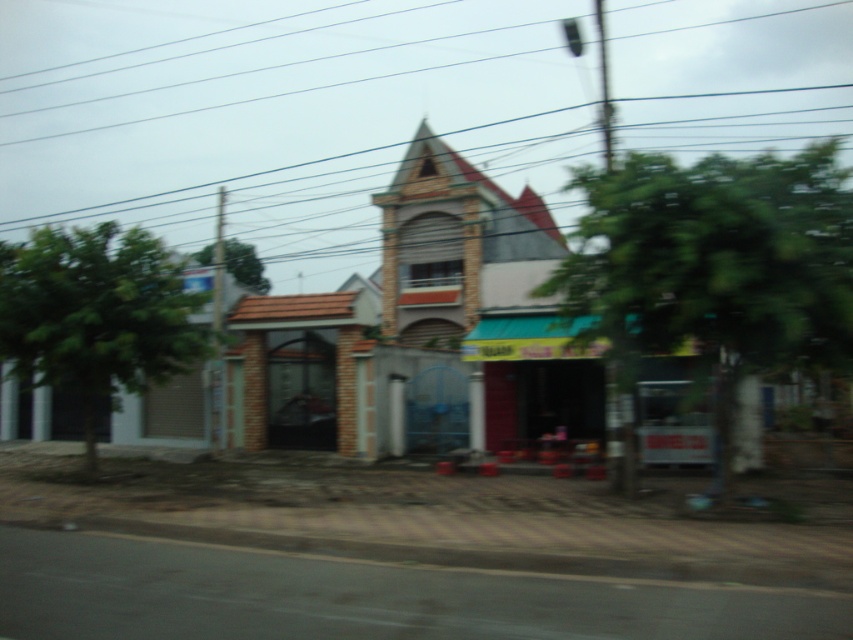
Question: Does metallic wire at upper center appear on the right side of green leafy tree at upper center?

Choices:
 (A) no
 (B) yes

Answer: (B)

Question: Which is nearer to the green leafy tree at left?

Choices:
 (A) metallic wire at upper center
 (B) green leafy tree at upper center
 (C) green leafy tree at center

Answer: (C)

Question: Is green leafy tree at center positioned in front of green leafy tree at upper center?

Choices:
 (A) yes
 (B) no

Answer: (A)

Question: Which point is farther to the camera?

Choices:
 (A) (669, 257)
 (B) (434, 38)

Answer: (B)

Question: Can you confirm if green leafy tree at center is positioned below green leafy tree at left?

Choices:
 (A) yes
 (B) no

Answer: (A)

Question: Based on their relative distances, which object is nearer to the green leafy tree at upper center?

Choices:
 (A) metallic wire at upper center
 (B) green leafy tree at left

Answer: (B)